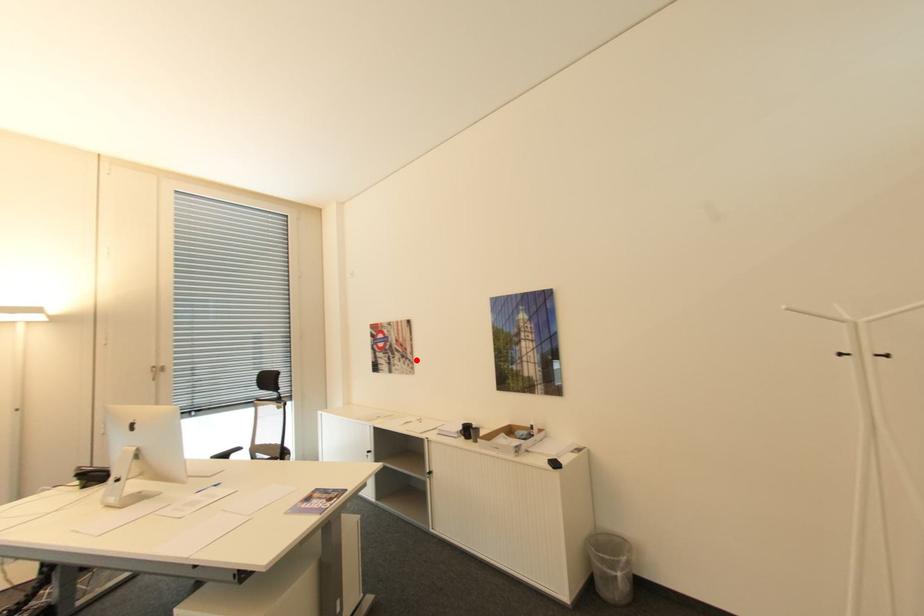
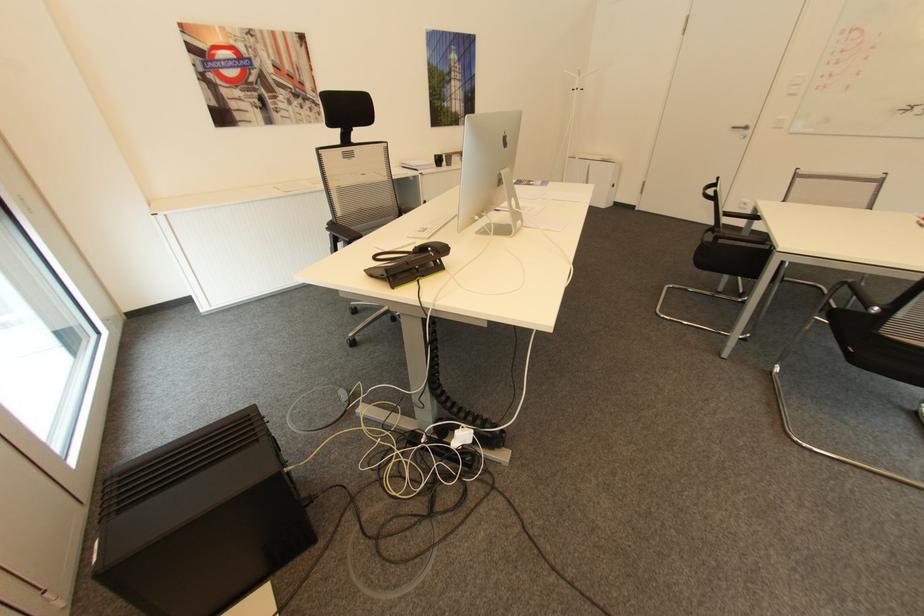
Locate, in the second image, the point that corresponds to the highlighted location in the first image.

(322, 102)